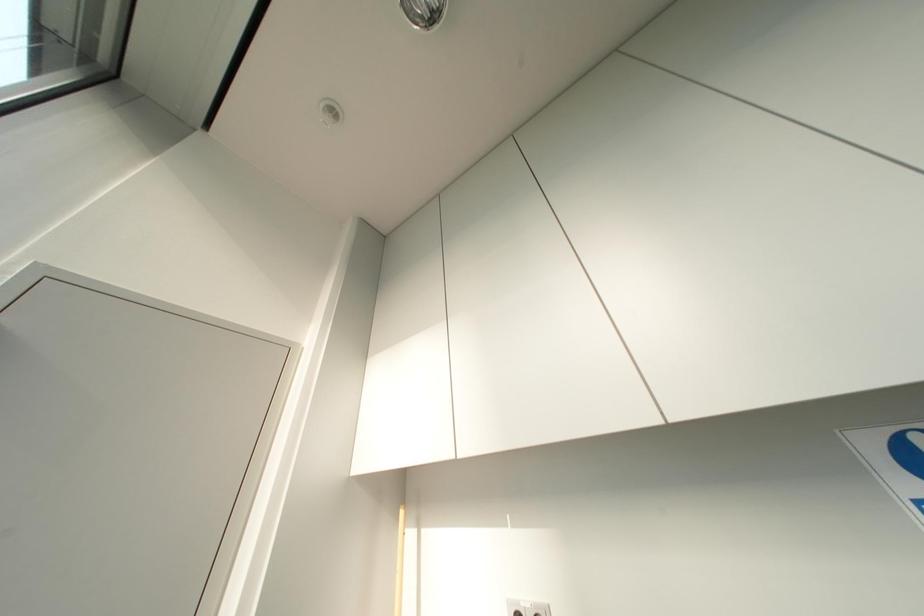
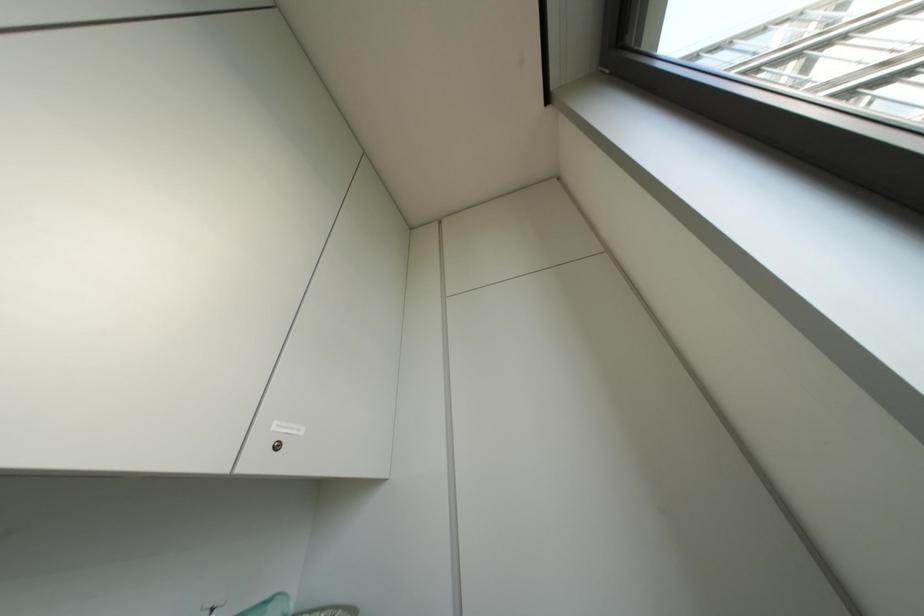
The first image is from the beginning of the video and the second image is from the end. How did the camera likely rotate when shooting the video?

The rotation direction of the camera is right-up.